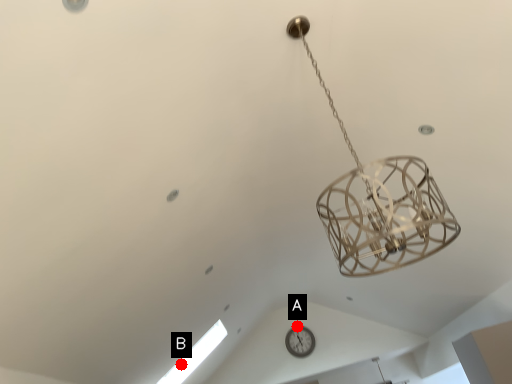
Question: Two points are circled on the image, labeled by A and B beside each circle. Which point is closer to the camera?

Choices:
 (A) A is closer
 (B) B is closer

Answer: (B)